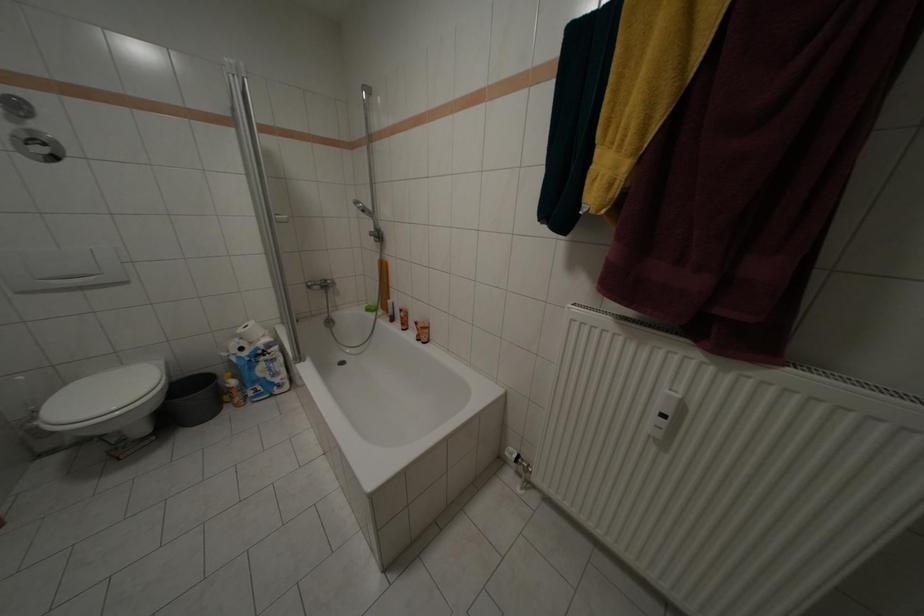
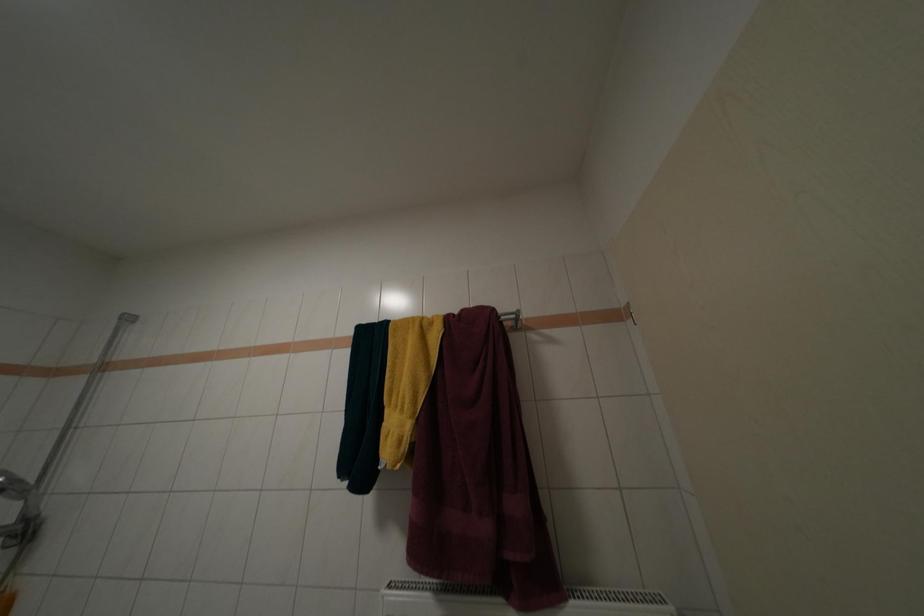
How did the camera likely rotate?

The camera rotated toward right-up.